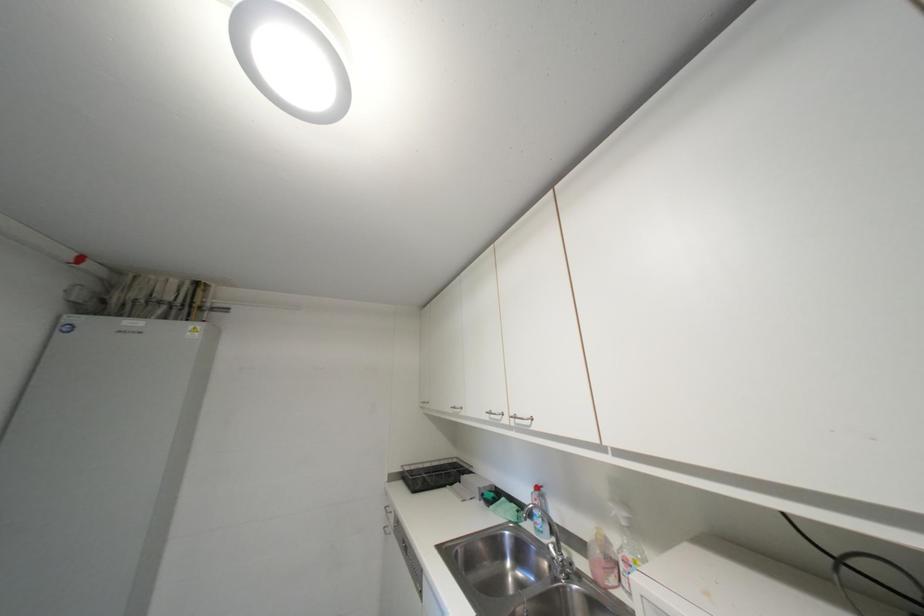
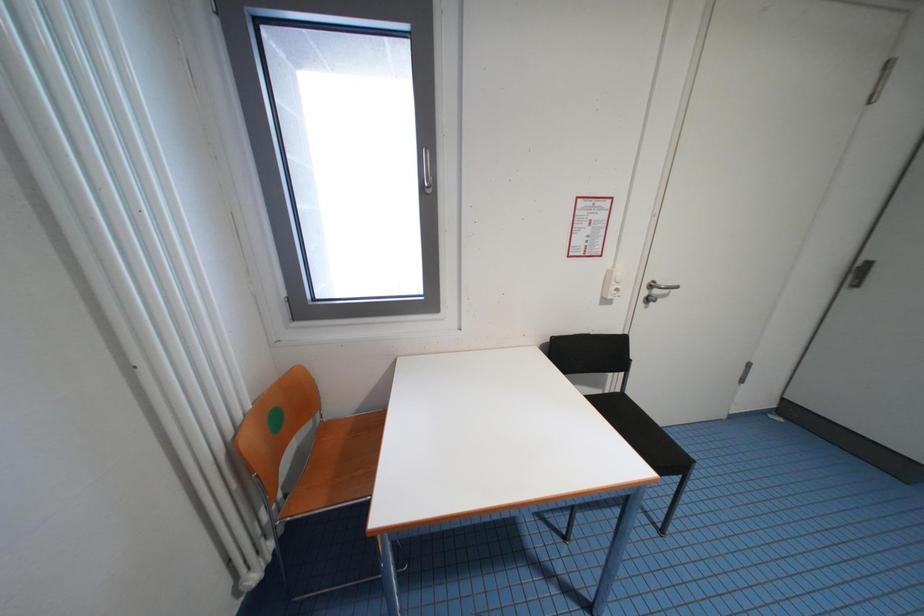
The first image is from the beginning of the video and the second image is from the end. How did the camera likely rotate when shooting the video?

The camera rotated toward left-down.